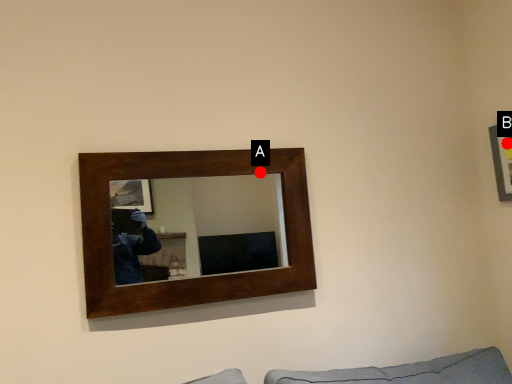
Question: Two points are circled on the image, labeled by A and B beside each circle. Which of the following is the closest to the observer?

Choices:
 (A) A is closer
 (B) B is closer

Answer: (A)